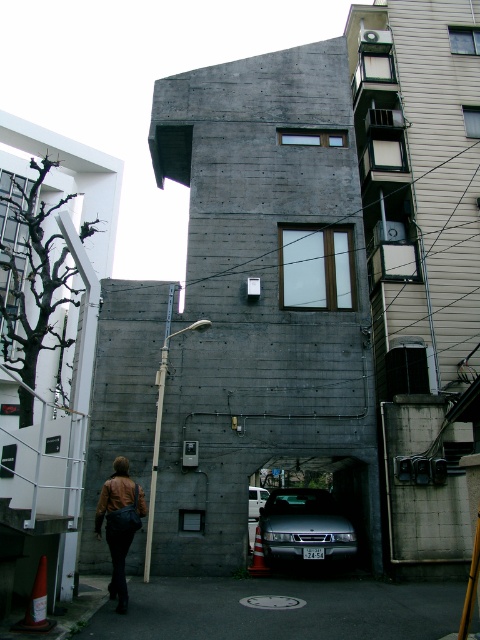
Does dark concrete alley at lower center appear over brown leather jacket at lower left?

Incorrect, dark concrete alley at lower center is not positioned above brown leather jacket at lower left.

Is point (166, 616) closer to viewer compared to point (108, 477)?

Yes, it is in front of point (108, 477).

Locate an element on the screen. dark concrete alley at lower center is located at coordinates (280, 611).

Who is positioned more to the right, brown leather jacket at lower left or metallic silver car at center?

metallic silver car at center

Between point (119, 516) and point (253, 513), which one is positioned in front?

Point (119, 516)

This screenshot has height=640, width=480. I want to click on brown leather jacket at lower left, so [x=119, y=524].

Can you confirm if silver metallic sedan at center is positioned below metallic silver car at center?

No.

Does silver metallic sedan at center have a smaller size compared to metallic silver car at center?

Correct, silver metallic sedan at center occupies less space than metallic silver car at center.

What do you see at coordinates (304, 525) in the screenshot? I see `silver metallic sedan at center` at bounding box center [304, 525].

In order to click on silver metallic sedan at center in this screenshot , I will do `click(304, 525)`.